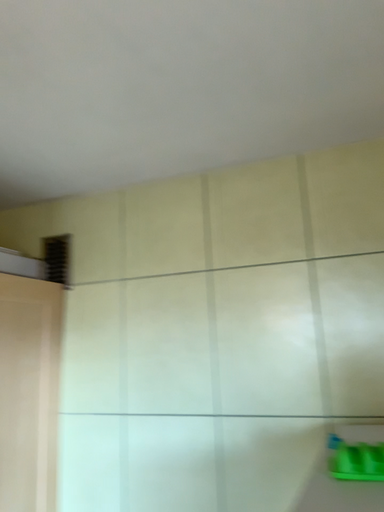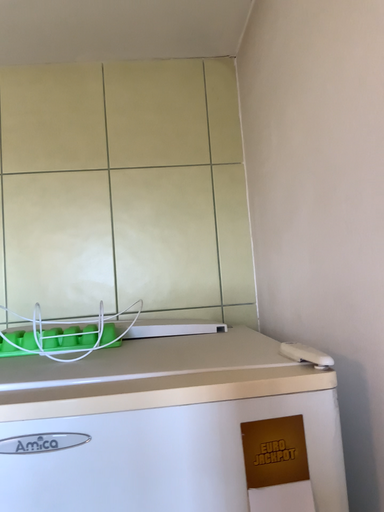
Question: How did the camera likely rotate when shooting the video?

Choices:
 (A) rotated downward
 (B) rotated upward

Answer: (A)